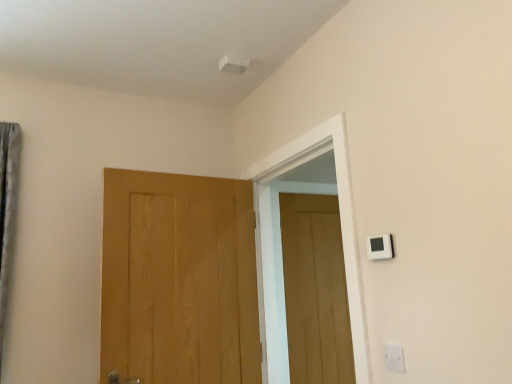
Question: Is light brown wood door at center, the second door from the back, to the left or to the right of wooden door at center, the first door positioned from the back, in the image?

Choices:
 (A) right
 (B) left

Answer: (B)

Question: From a real-world perspective, is light brown wood door at center, the second door from the back, physically located above or below wooden door at center, the first door positioned from the back?

Choices:
 (A) above
 (B) below

Answer: (A)

Question: Estimate the real-world distances between objects in this image. Which object is closer to the white plastic light switch at upper right?

Choices:
 (A) wooden door at center, the second door in the front-to-back sequence
 (B) white plastic electric outlet at lower right
 (C) light brown wood door at center, the second door from the back

Answer: (B)

Question: Estimate the real-world distances between objects in this image. Which object is closer to the white plastic electric outlet at lower right?

Choices:
 (A) light brown wood door at center, the 1th door viewed from the front
 (B) white plastic light switch at upper right
 (C) wooden door at center, the 1th door in the right-to-left sequence

Answer: (B)